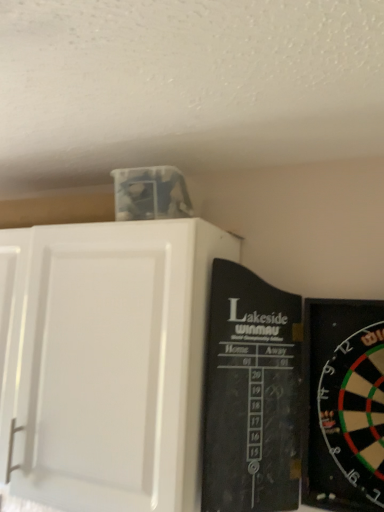
Question: Is the position of black plastic dartboard at right more distant than that of white matte cabinet at upper left?

Choices:
 (A) no
 (B) yes

Answer: (A)

Question: From a real-world perspective, does black plastic dartboard at right sit lower than white matte cabinet at upper left?

Choices:
 (A) yes
 (B) no

Answer: (A)

Question: Considering the relative sizes of black plastic dartboard at right and white matte cabinet at upper left in the image provided, is black plastic dartboard at right taller than white matte cabinet at upper left?

Choices:
 (A) yes
 (B) no

Answer: (B)

Question: Is black plastic dartboard at right oriented away from white matte cabinet at upper left?

Choices:
 (A) yes
 (B) no

Answer: (B)

Question: From the image's perspective, is black plastic dartboard at right on top of white matte cabinet at upper left?

Choices:
 (A) yes
 (B) no

Answer: (B)

Question: Considering the relative positions of black plastic dartboard at right and white matte cabinet at upper left in the image provided, is black plastic dartboard at right to the left of white matte cabinet at upper left from the viewer's perspective?

Choices:
 (A) no
 (B) yes

Answer: (A)

Question: From a real-world perspective, is white matte cabinet at upper left located higher than black plastic dartboard at right?

Choices:
 (A) yes
 (B) no

Answer: (A)

Question: Is white matte cabinet at upper left at the right side of black plastic dartboard at right?

Choices:
 (A) yes
 (B) no

Answer: (B)

Question: Considering the relative positions of white matte cabinet at upper left and black plastic dartboard at right in the image provided, is white matte cabinet at upper left behind black plastic dartboard at right?

Choices:
 (A) yes
 (B) no

Answer: (A)

Question: From a real-world perspective, is white matte cabinet at upper left below black plastic dartboard at right?

Choices:
 (A) no
 (B) yes

Answer: (A)

Question: Is white matte cabinet at upper left beside black plastic dartboard at right?

Choices:
 (A) yes
 (B) no

Answer: (B)

Question: Is white matte cabinet at upper left aimed at black plastic dartboard at right?

Choices:
 (A) yes
 (B) no

Answer: (B)

Question: From the image's perspective, is white matte cabinet at upper left positioned above or below black plastic dartboard at right?

Choices:
 (A) below
 (B) above

Answer: (B)